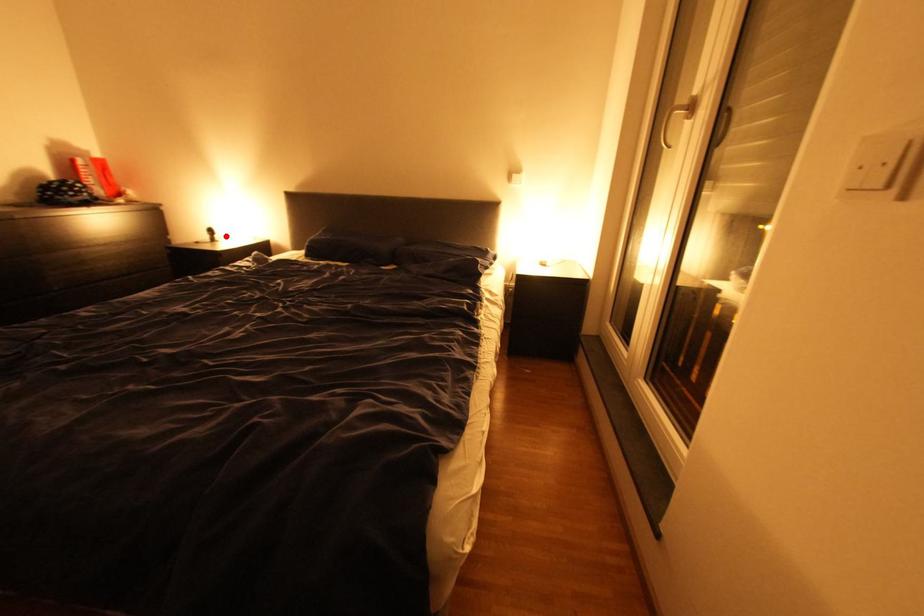
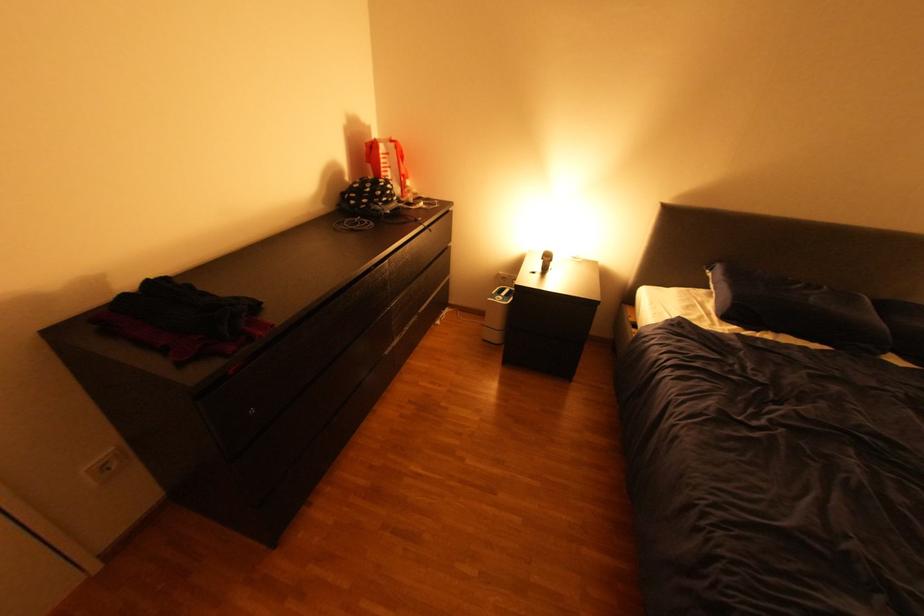
In the second image, find the point that corresponds to the highlighted location in the first image.

(561, 262)